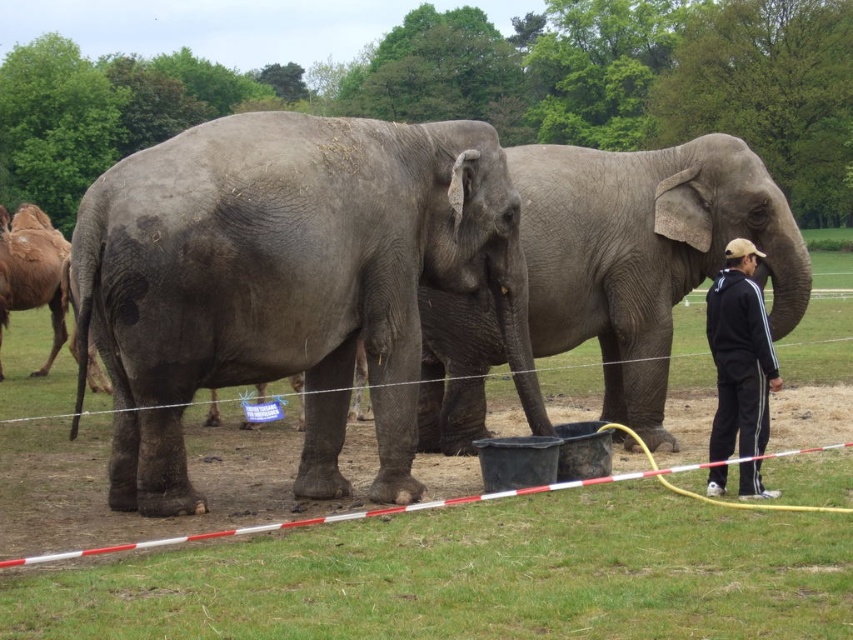
Can you confirm if gray textured elephant at center is taller than black track suit at right?

Yes, gray textured elephant at center is taller than black track suit at right.

Between point (390, 397) and point (764, 419), which one is positioned behind?

The point (390, 397) is more distant.

You are a GUI agent. You are given a task and a screenshot of the screen. Output one action in this format:
    pyautogui.click(x=<x>, y=<y>)
    Task: Click on the gray textured elephant at center
    The width and height of the screenshot is (853, 640).
    Given the screenshot: What is the action you would take?
    pyautogui.click(x=288, y=284)

Which of these two, gray textured elephant at center or gray matte elephant at center, stands taller?

With more height is gray matte elephant at center.

Between point (186, 512) and point (572, 312), which one is positioned in front?

Point (186, 512) is in front.

The width and height of the screenshot is (853, 640). I want to click on gray textured elephant at center, so click(x=288, y=284).

Consider the image. Does gray matte elephant at center appear under black track suit at right?

Incorrect, gray matte elephant at center is not positioned below black track suit at right.

Is the position of gray matte elephant at center less distant than that of black track suit at right?

No, it is behind black track suit at right.

Which is in front, point (511, 152) or point (750, 467)?

Positioned in front is point (750, 467).

The width and height of the screenshot is (853, 640). In order to click on gray matte elephant at center in this screenshot , I will do `click(643, 253)`.